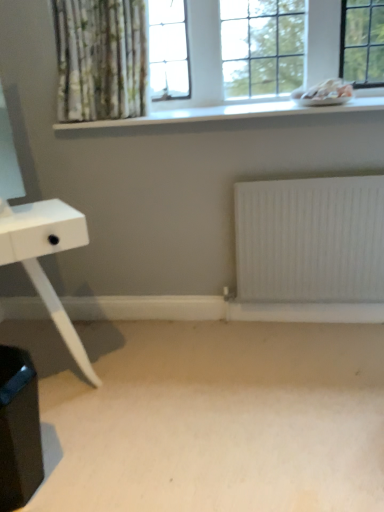
Locate an element on the screen. free spot below white matte radiator at lower center (from a real-world perspective) is located at coordinates (311, 321).